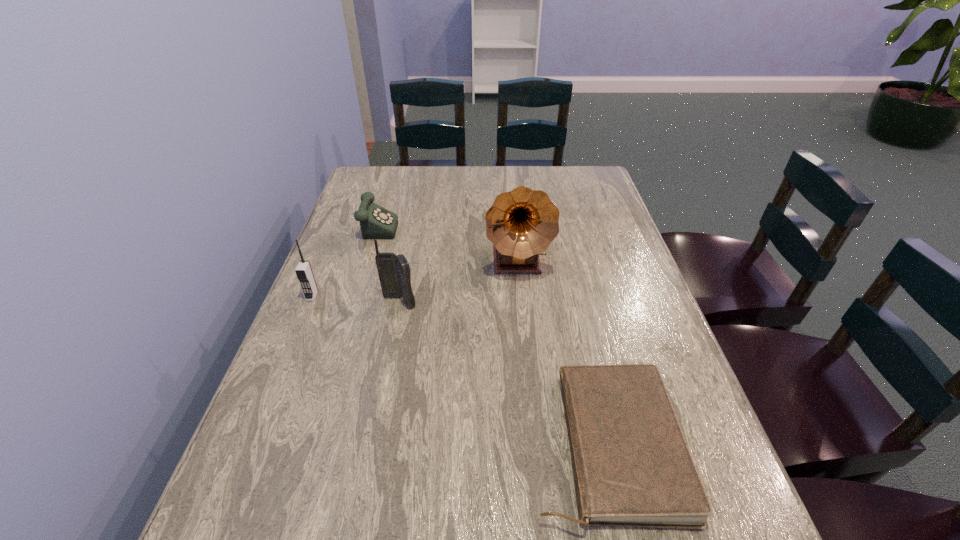
Where is `vacant area that lies between the phonograph_record and the paperback book`? The image size is (960, 540). vacant area that lies between the phonograph_record and the paperback book is located at coordinates (561, 354).

At what (x,y) coordinates should I click in order to perform the action: click on empty location between the phonograph_record and the right cellular telephone. Please return your answer as a coordinate pair (x, y). Looking at the image, I should click on (458, 283).

Where is `free space between the left cellular telephone and the phonograph_record`? The width and height of the screenshot is (960, 540). free space between the left cellular telephone and the phonograph_record is located at coordinates click(x=415, y=280).

At what (x,y) coordinates should I click in order to perform the action: click on free space between the right cellular telephone and the phonograph_record. Please return your answer as a coordinate pair (x, y). Looking at the image, I should click on (458, 283).

The height and width of the screenshot is (540, 960). Identify the location of free space that is in between the third object from left to right and the phonograph_record. 458,283.

Where is `free point between the nearest object and the leftmost object`? This screenshot has width=960, height=540. free point between the nearest object and the leftmost object is located at coordinates pyautogui.click(x=459, y=370).

At what (x,y) coordinates should I click in order to perform the action: click on vacant area that lies between the phonograph_record and the third object from left to right. Please return your answer as a coordinate pair (x, y). The width and height of the screenshot is (960, 540). Looking at the image, I should click on (458, 283).

At what (x,y) coordinates should I click in order to perform the action: click on vacant region between the telephone and the tallest object. Please return your answer as a coordinate pair (x, y). This screenshot has width=960, height=540. Looking at the image, I should click on (446, 244).

Locate an element on the screen. The height and width of the screenshot is (540, 960). vacant region between the phonograph_record and the left cellular telephone is located at coordinates (415, 280).

In order to click on the fourth closest object to the right cellular telephone in this screenshot , I will do `click(632, 467)`.